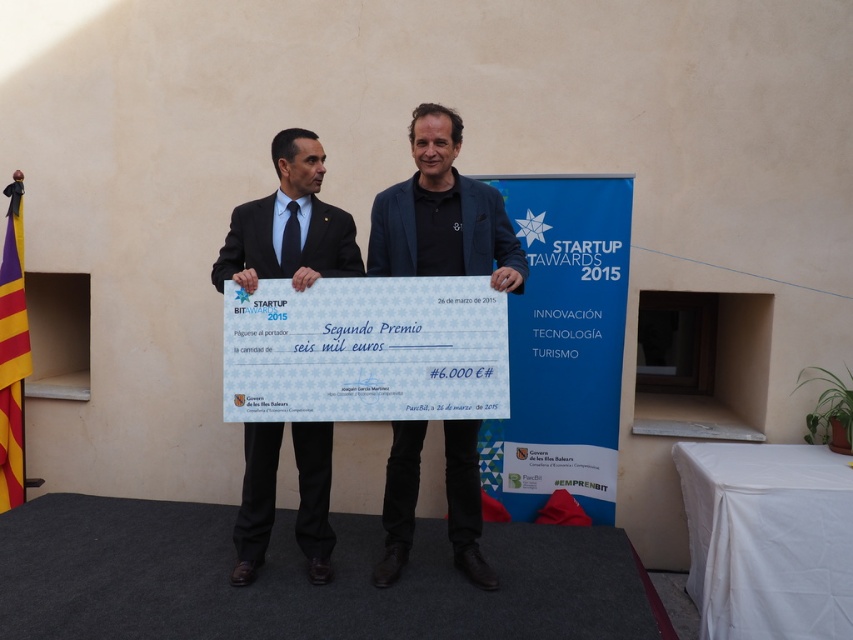
You are a photographer positioned at the front of the stage. You need to focus your camera on the dark blue woolen suit at center. According to the coordinates provided, where should you aim your camera?

You should aim your camera at the coordinates point (442, 230) where the dark blue woolen suit at center is located.

You are a photographer standing 5 feet away from the stage. You want to capture a photo of both the dark blue woolen suit at center and the matte black suit at center in the same frame. Given that your camera has a 50mm lens, which has a field of view that can cover about 46 inches at this distance, will you be able to fit both suits in the frame without moving closer?

The distance between the dark blue woolen suit at center and the matte black suit at center is 31.48 inches. Since the camera lens can cover 46 inches at this distance, which is wider than the 31.48 inches separating the two suits, you can fit both suits in the frame without moving closer.